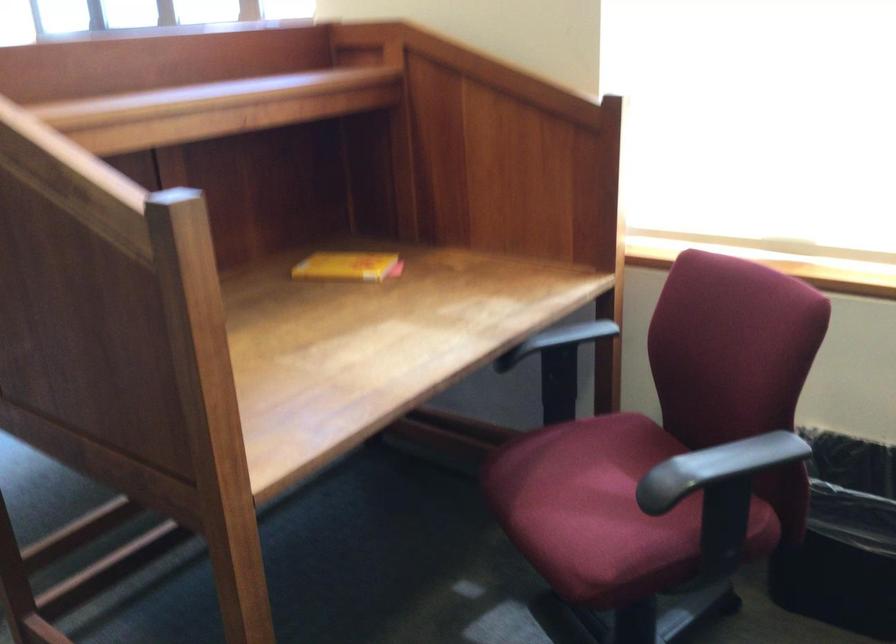
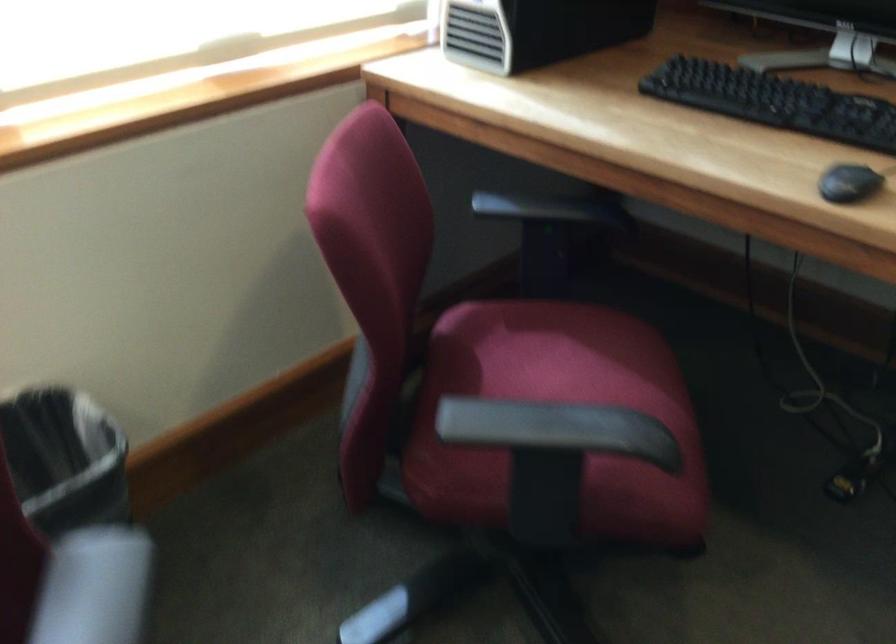
Based on the continuous images, in which direction is the camera rotating?

The rotation direction of the camera is right-down.